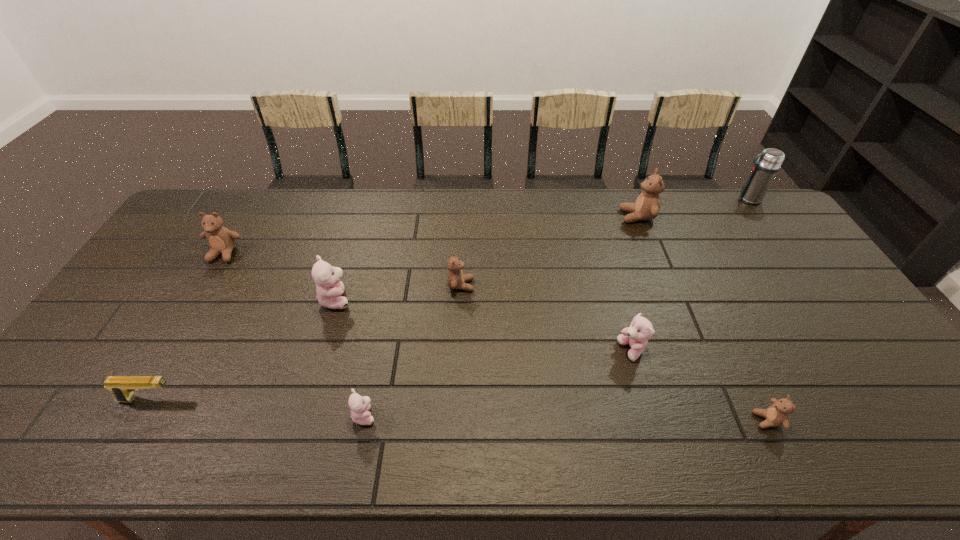
Find the location of a particular element. The height and width of the screenshot is (540, 960). vacant region located on the front-facing side of the rightmost teddy bear is located at coordinates (643, 420).

Find the location of a particular element. This screenshot has width=960, height=540. free space located 0.150m on the front-facing side of the rightmost teddy bear is located at coordinates (690, 420).

At what (x,y) coordinates should I click in order to perform the action: click on vacant space situated 0.090m on the front-facing side of the rightmost teddy bear. Please return your answer as a coordinate pair (x, y). This screenshot has width=960, height=540. Looking at the image, I should click on (716, 420).

The image size is (960, 540). What are the coordinates of `free space located at the face of the sixth object from right to left` in the screenshot? It's located at (453, 415).

Locate an element on the screen. The image size is (960, 540). thermos bottle that is at the far edge is located at coordinates (764, 171).

Locate an element on the screen. Image resolution: width=960 pixels, height=540 pixels. teddy bear situated at the far edge is located at coordinates (647, 206).

Locate an element on the screen. The height and width of the screenshot is (540, 960). object at the left edge is located at coordinates pos(221,240).

The width and height of the screenshot is (960, 540). I want to click on object that is at the right edge, so click(764, 171).

You are a GUI agent. You are given a task and a screenshot of the screen. Output one action in this format:
    pyautogui.click(x=<x>, y=<y>)
    Task: Click on the object that is at the far right corner
    The height and width of the screenshot is (540, 960).
    Given the screenshot: What is the action you would take?
    pyautogui.click(x=764, y=171)

The height and width of the screenshot is (540, 960). In the image, there is a desktop. What are the coordinates of `vacant space at the far edge` in the screenshot? It's located at (459, 205).